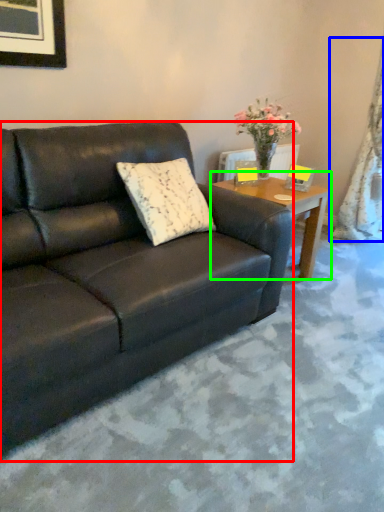
Question: Considering the real-world distances, which object is closest to studio couch (highlighted by a red box)? curtain (highlighted by a blue box) or coffee table (highlighted by a green box).

Choices:
 (A) curtain
 (B) coffee table

Answer: (B)